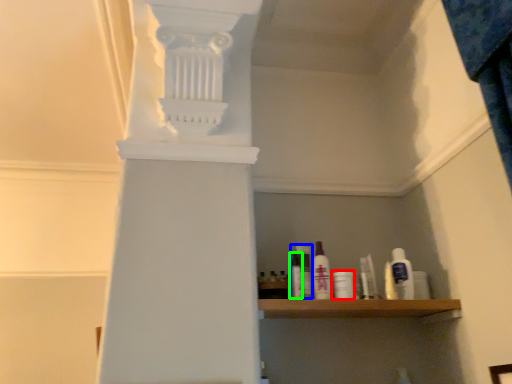
Question: Estimate the real-world distances between objects in this image. Which object is farther from toiletry (highlighted by a red box), mouthwash (highlighted by a blue box) or toiletry (highlighted by a green box)?

Choices:
 (A) mouthwash
 (B) toiletry

Answer: (B)